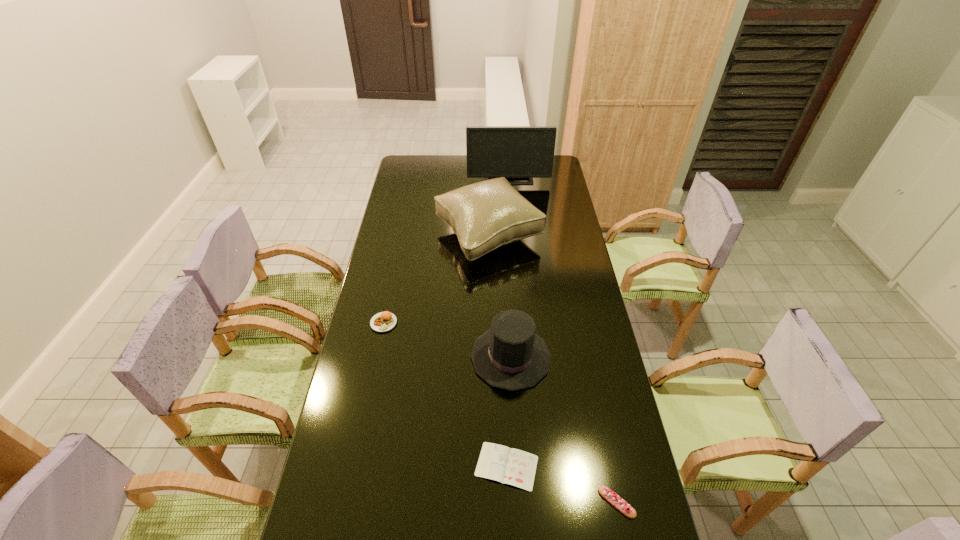
Identify the location of the farthest object. This screenshot has height=540, width=960. (514, 152).

At what (x,y) coordinates should I click in order to perform the action: click on computer monitor. Please return your answer as a coordinate pair (x, y). Looking at the image, I should click on (514, 152).

Identify the location of the fifth shortest object. 486,215.

You are a GUI agent. You are given a task and a screenshot of the screen. Output one action in this format:
    pyautogui.click(x=<x>, y=<y>)
    Task: Click on the fifth nearest object
    
    Given the screenshot: What is the action you would take?
    pyautogui.click(x=486, y=215)

The height and width of the screenshot is (540, 960). I want to click on the third tallest object, so click(510, 355).

Locate an element on the screen. This screenshot has width=960, height=540. patty is located at coordinates (382, 322).

At what (x,y) coordinates should I click in order to perform the action: click on the fourth tallest object. Please return your answer as a coordinate pair (x, y). Looking at the image, I should click on (382, 322).

Locate an element on the screen. This screenshot has height=540, width=960. eclair is located at coordinates (612, 497).

At what (x,y) coordinates should I click in order to perform the action: click on the shortest object. Please return your answer as a coordinate pair (x, y). Looking at the image, I should click on (500, 463).

Find the location of a particular element. vacant region located on the screen side of the computer monitor is located at coordinates (513, 224).